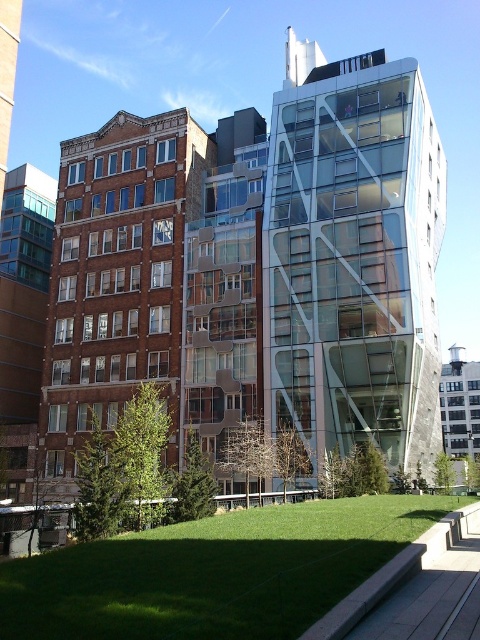
Question: Which point is farther to the camera?

Choices:
 (A) (139, 554)
 (B) (349, 189)

Answer: (B)

Question: Does transparent glass building at center appear under green grass at lower center?

Choices:
 (A) no
 (B) yes

Answer: (A)

Question: Is transparent glass building at center wider than green grass at lower center?

Choices:
 (A) yes
 (B) no

Answer: (B)

Question: Can you confirm if transparent glass building at center is wider than green grass at lower center?

Choices:
 (A) no
 (B) yes

Answer: (A)